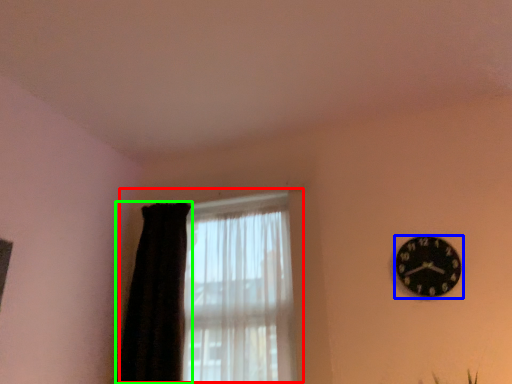
Question: Which object is the farthest from window (highlighted by a red box)? Choose among these: wall clock (highlighted by a blue box) or curtain (highlighted by a green box).

Choices:
 (A) wall clock
 (B) curtain

Answer: (A)